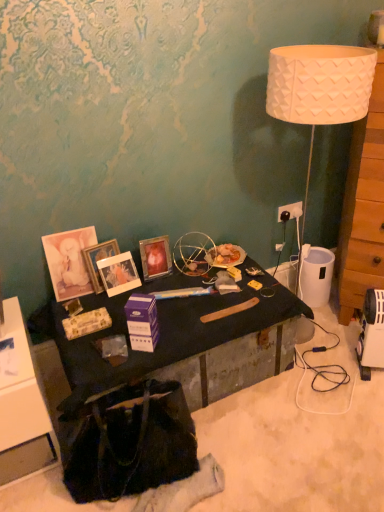
Where is `free point to the right of black fabric handbag at lower left`? free point to the right of black fabric handbag at lower left is located at coordinates (242, 446).